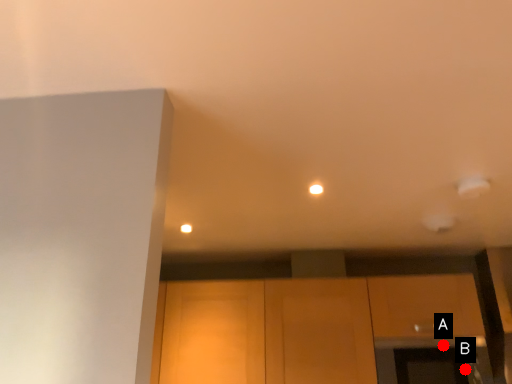
Question: Two points are circled on the image, labeled by A and B beside each circle. Which point appears closest to the camera in this image?

Choices:
 (A) A is closer
 (B) B is closer

Answer: (B)